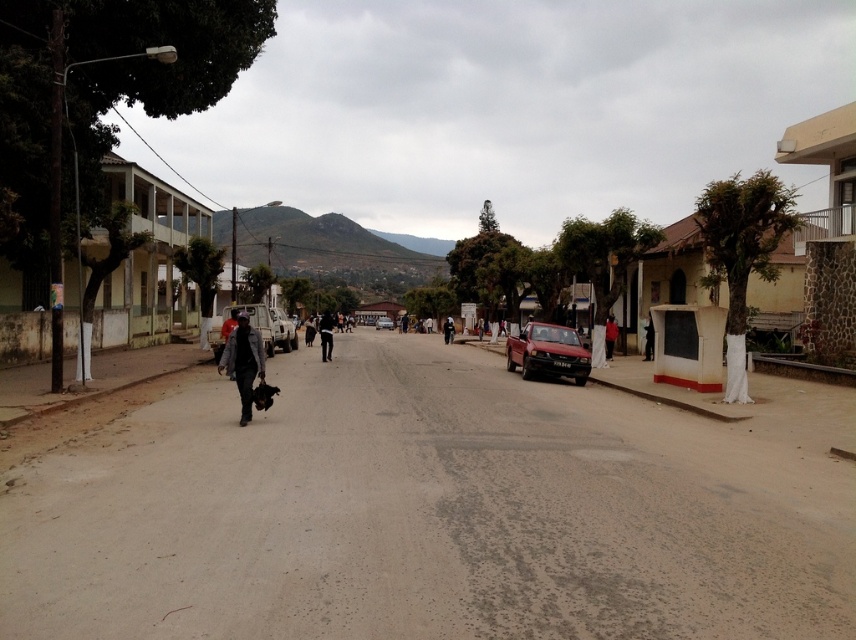
At what (x,y) coordinates should I click in order to perform the action: click on matte white van at center-left. Please return your answer as a coordinate pair (x, y). Image resolution: width=856 pixels, height=640 pixels. Looking at the image, I should click on (254, 321).

Is dirt track at center to the left of metallic silver truck at center-left from the viewer's perspective?

In fact, dirt track at center is to the right of metallic silver truck at center-left.

Is dirt track at center taller than metallic silver truck at center-left?

In fact, dirt track at center may be shorter than metallic silver truck at center-left.

Is point (675, 584) less distant than point (296, 337)?

Yes, it is.

Where is `dirt track at center`? The width and height of the screenshot is (856, 640). dirt track at center is located at coordinates (425, 515).

Does dirt track at center appear under shiny red car at center?

Yes.

Which is below, dirt track at center or shiny red car at center?

dirt track at center

This screenshot has width=856, height=640. I want to click on dirt track at center, so click(x=425, y=515).